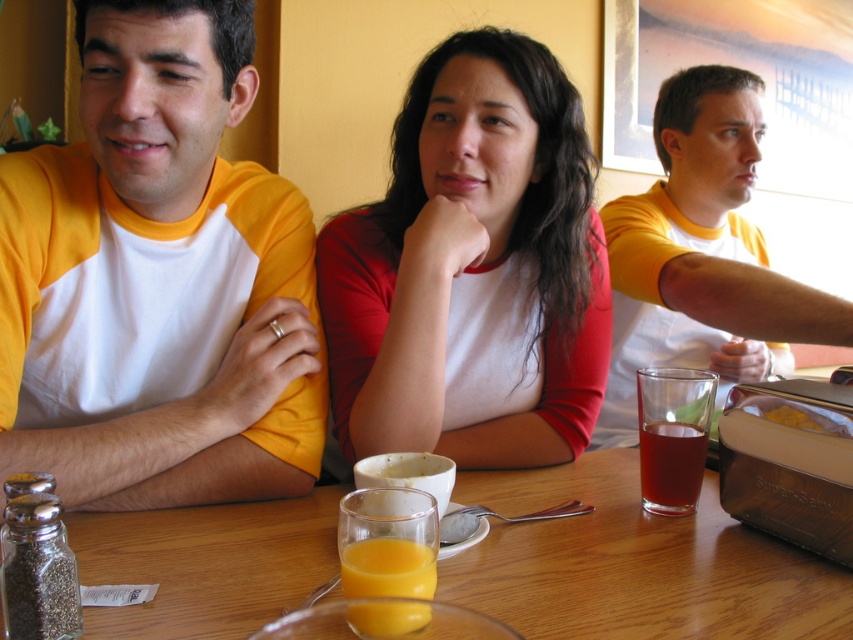
From the picture: You are a server at the restaurant and need to place a new menu between the matte white shirt at center and the orange translucent glass at center. Which object should you place the menu closer to if you want the menu to be near the larger object?

The matte white shirt at center is bigger than the orange translucent glass at center, so you should place the menu closer to the matte white shirt at center.

You are a waiter at this table and need to deliver a napkin to the person wearing the yellow cotton shirt at left and the yellow cotton shirt at upper right. Which shirt is closer to you so you can reach first?

The yellow cotton shirt at left is closer to the viewer than the yellow cotton shirt at upper right, so you should reach for the yellow cotton shirt at left first.